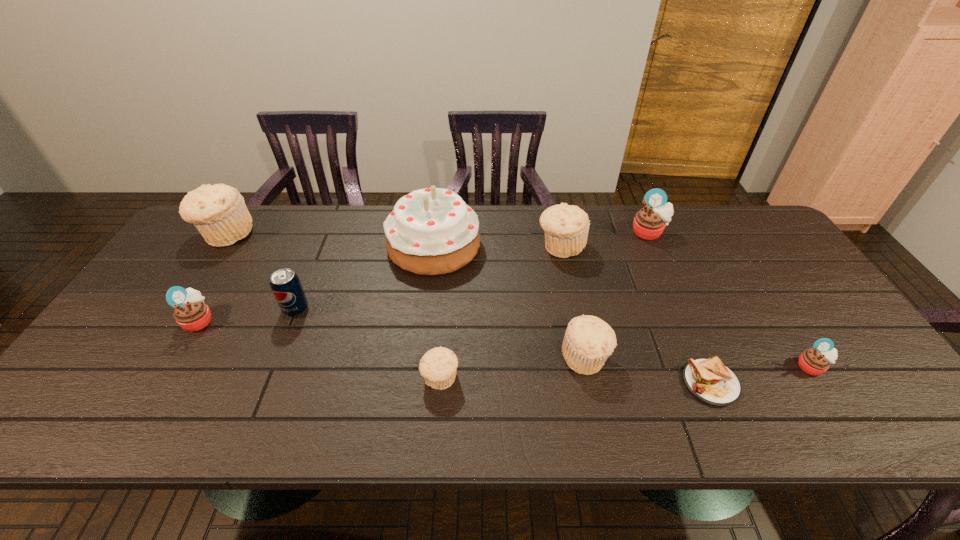
Select which beige muffin appears as the second closest to the cake. Please provide its 2D coordinates. Your answer should be formatted as a tuple, i.e. [(x, y)], where the tuple contains the x and y coordinates of a point satisfying the conditions above.

[(588, 342)]

Locate an element on the screen. The image size is (960, 540). pink muffin that is the nearest to the second biggest beige muffin is located at coordinates (649, 223).

Where is `pink muffin that can be found as the closest to the leftmost pink muffin`? Image resolution: width=960 pixels, height=540 pixels. pink muffin that can be found as the closest to the leftmost pink muffin is located at coordinates (649, 223).

You are a GUI agent. You are given a task and a screenshot of the screen. Output one action in this format:
    pyautogui.click(x=<x>, y=<y>)
    Task: Click on the free spot that satisfies the following two spatial constraints: 1. on the front-facing side of the second nearest pink muffin; 2. on the back side of the smallest beige muffin
    
    Given the screenshot: What is the action you would take?
    pyautogui.click(x=164, y=379)